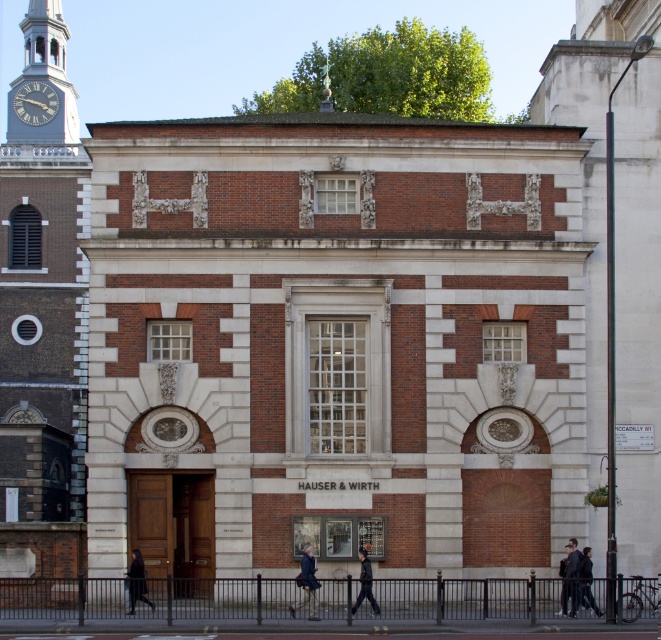
Question: Can you confirm if dark blue fabric at center is positioned above dark brown leather coat at lower center?

Choices:
 (A) yes
 (B) no

Answer: (A)

Question: Which object appears closest to the camera in this image?

Choices:
 (A) black leather jacket at center
 (B) dark blue jacket at lower right
 (C) silver metallic clock tower at upper left
 (D) dark gray jacket at center

Answer: (A)

Question: Can you confirm if dark brown leather coat at lower center is bigger than black leather jacket at center?

Choices:
 (A) yes
 (B) no

Answer: (B)

Question: Is the position of silver metallic clock tower at upper left more distant than that of dark gray jacket at center?

Choices:
 (A) no
 (B) yes

Answer: (B)

Question: Which point is farther to the camera?

Choices:
 (A) (36, 64)
 (B) (584, 584)
 (C) (364, 552)

Answer: (A)

Question: Which point is farther to the camera?

Choices:
 (A) (566, 582)
 (B) (17, 92)
 (C) (373, 612)
 (D) (582, 596)

Answer: (B)